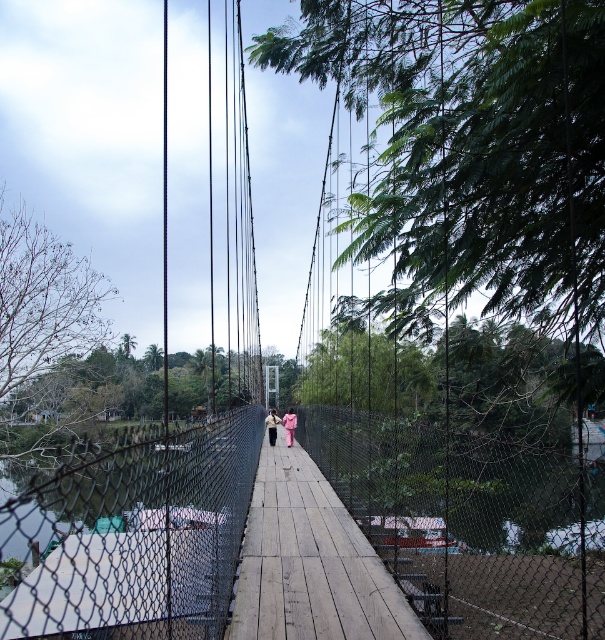
Is point (287, 432) closer to camera compared to point (270, 413)?

Yes, point (287, 432) is in front of point (270, 413).

Between point (286, 435) and point (272, 435), which one is positioned in front?

Point (272, 435) is more forward.

The height and width of the screenshot is (640, 605). I want to click on pink fabric at center, so click(x=289, y=426).

Where is `pink fabric at center`? This screenshot has height=640, width=605. pink fabric at center is located at coordinates (289, 426).